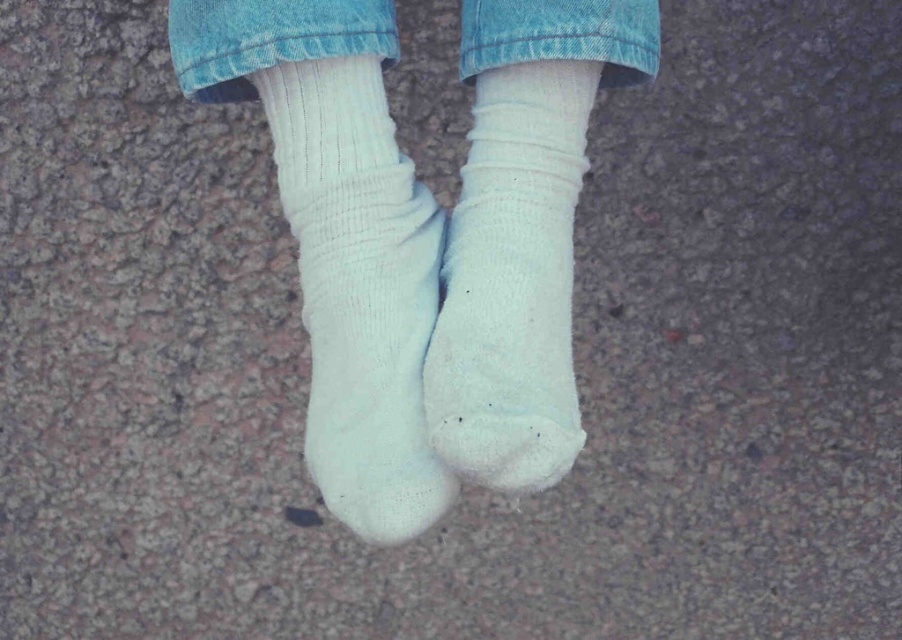
You are standing on the ground and looking down at your feet. There is a point marked at coordinates [360,292]. What object is located at that point?

The point at coordinates [360,292] marks the white ribbed sock at center.

You are a photographer taking a closeup shot of someone wearing white ribbed socks at center and white ribbed sock at center. Which sock is positioned higher in the frame?

The white ribbed socks at center is positioned higher than the white ribbed sock at center.